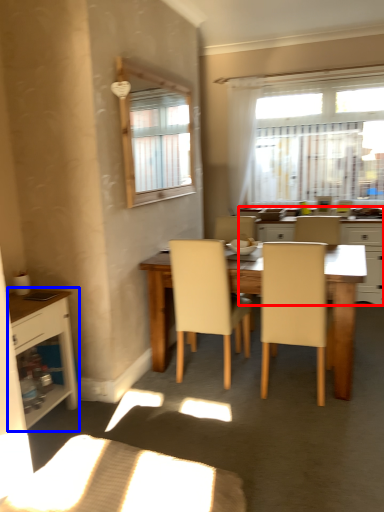
Question: Which object is further to the camera taking this photo, kitchen & dining room table (highlighted by a red box) or cabinetry (highlighted by a blue box)?

Choices:
 (A) kitchen & dining room table
 (B) cabinetry

Answer: (A)